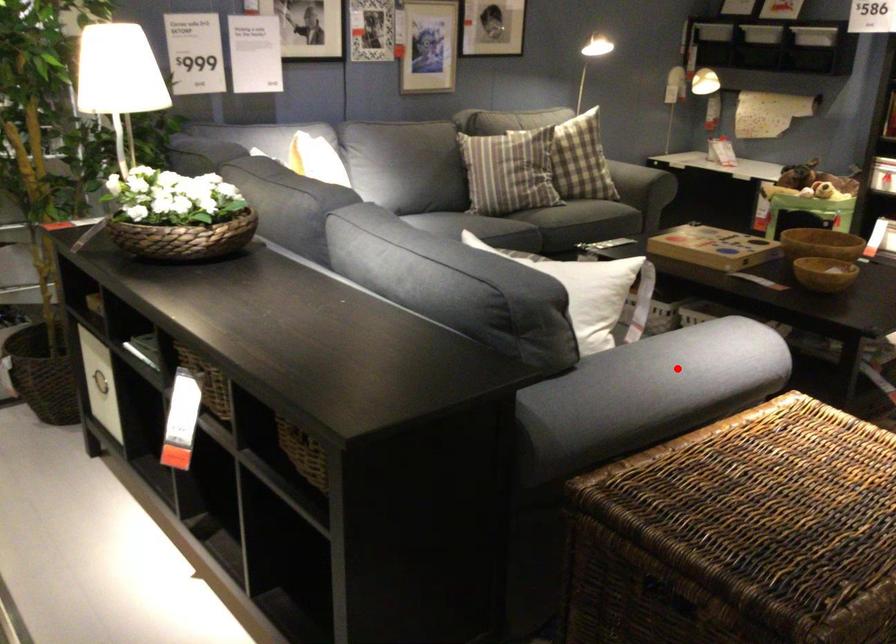
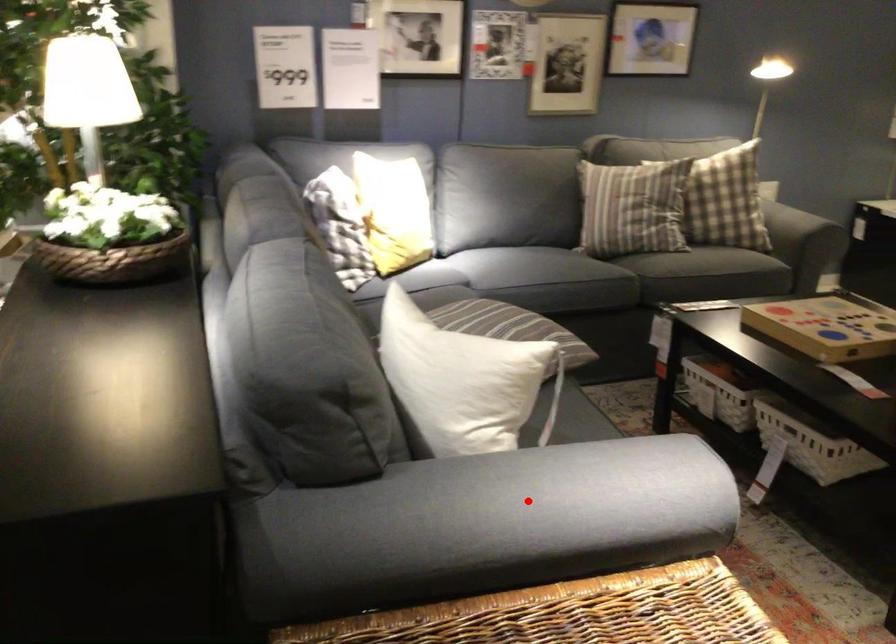
I am providing you with two images of the same scene from different viewpoints. A red point is marked on the first image and another point is marked on the second image. Does the point marked in image1 correspond to the same location as the one in image2?

Yes